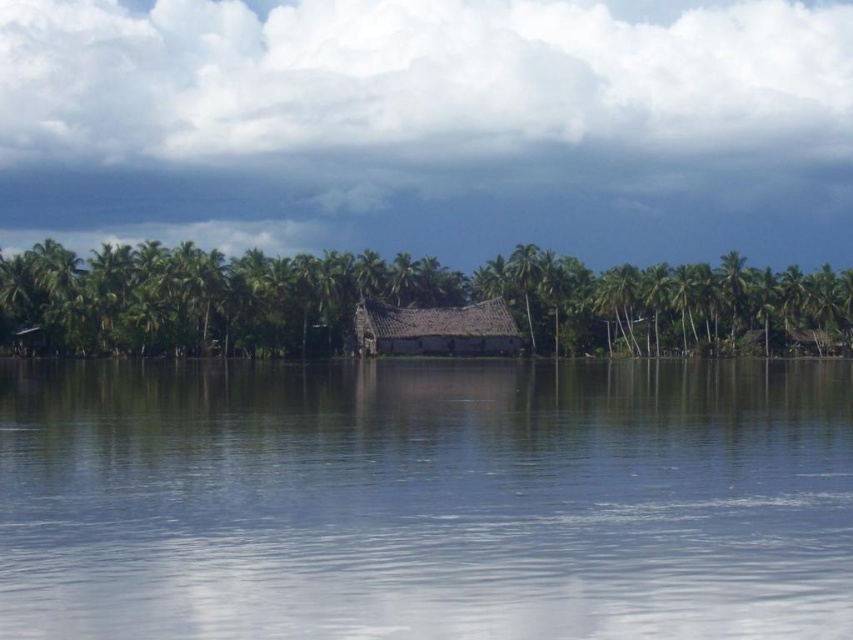
In the scene shown: You are standing on the shore looking at the clear water at center and the green leafy palm tree at center. Which object appears taller from your viewpoint?

The green leafy palm tree at center appears taller than the clear water at center because the clear water at center is not as tall as the green leafy palm tree at center.

You are standing at the edge of the water near the rustic thatched roof hut. You want to walk directly to the green leafy palm tree at right. However, there is a green leafy palm tree at center blocking your path. Can you walk around it without going further than 25 meters from your starting point?

The distance between the green leafy palm tree at center and the green leafy palm tree at right is 20.99 meters. Since the distance is less than 25 meters, you can walk around the green leafy palm tree at center and reach the green leafy palm tree at right without exceeding the 25 meters limit.